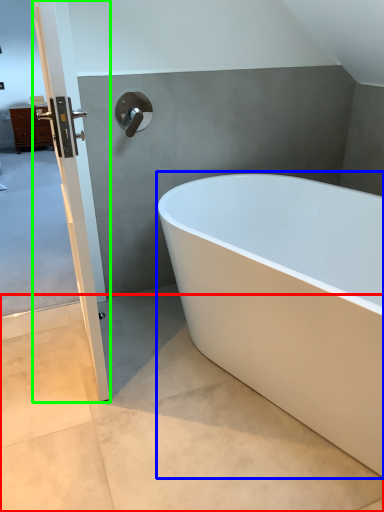
Question: Which object is the closest to the concrete (highlighted by a red box)? Choose among these: bathtub (highlighted by a blue box) or door (highlighted by a green box).

Choices:
 (A) bathtub
 (B) door

Answer: (B)